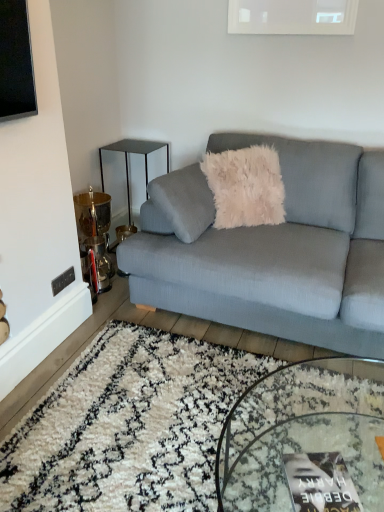
At what (x,y) coordinates should I click in order to perform the action: click on free location to the left of matte black magazine at lower center. Please return your answer as a coordinate pair (x, y). Looking at the image, I should click on (261, 488).